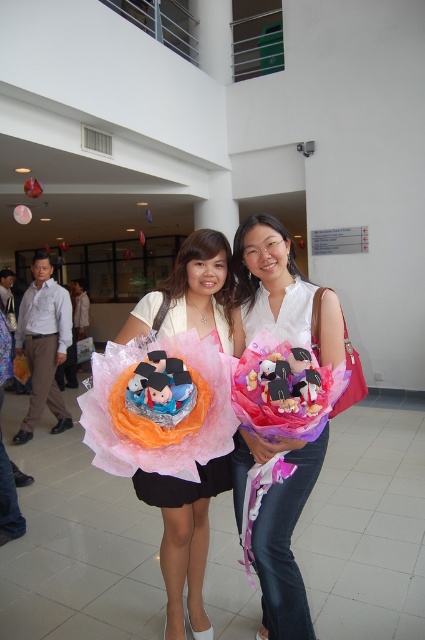
In the scene shown: You are a photographer adjusting the lighting for a photo shoot. You notice the white matte shirt at center and the matte pink fabric at center. Which item is covering part of the other?

The white matte shirt at center is positioned over matte pink fabric at center, so the white matte shirt at center is covering part of the matte pink fabric at center.

You are a photographer at a graduation ceremony. You need to decide which of the two outfits, the white matte shirt at center or the matte pink fabric dress at center, will require a wider space when arranging the participants for a group photo. Based on the description, which one would need more space?

The white matte shirt at center has a larger size compared to the matte pink fabric dress at center, so it would require more space when arranging participants for a group photo.

Based on the scene description, where is the matte pink fabric at center located in the image?

The matte pink fabric at center is located at point (184, 538) in the image.